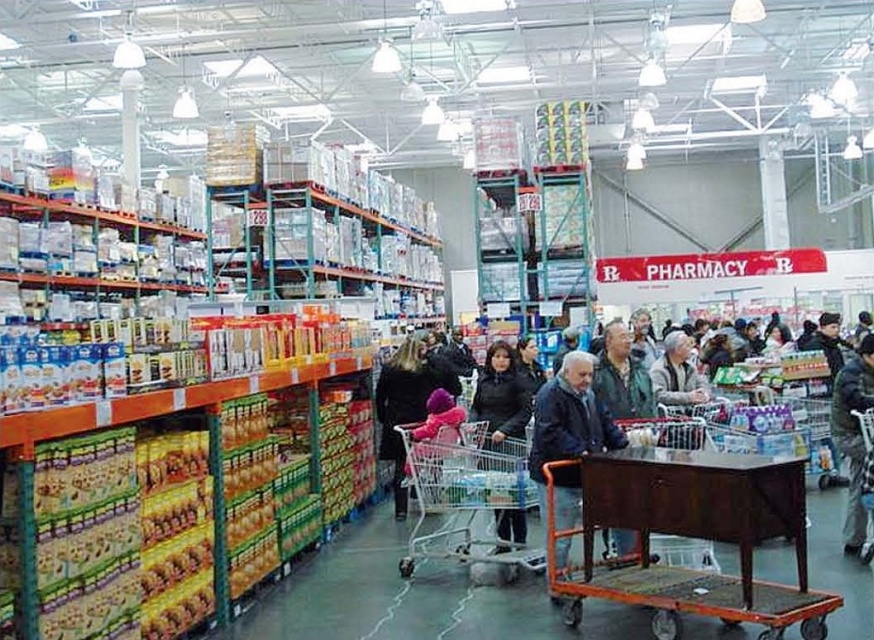
Consider the image. You are a customer in the store and want to pick up the black matte coat at center. However, there is a metallic silver shopping cart at center in the way. Can you reach the coat without moving the cart?

The metallic silver shopping cart at center is positioned under the black matte coat at center, so the coat is hanging above the cart. You can reach the coat without moving the cart by simply reaching over or around the cart.

You are a customer in the store and want to pick up the dark gray coat at center. However, there is a wooden table at center in your way. Can you reach the coat without moving the table?

The wooden table at center is in front of the dark gray coat at center, so you cannot reach the coat without moving the table.